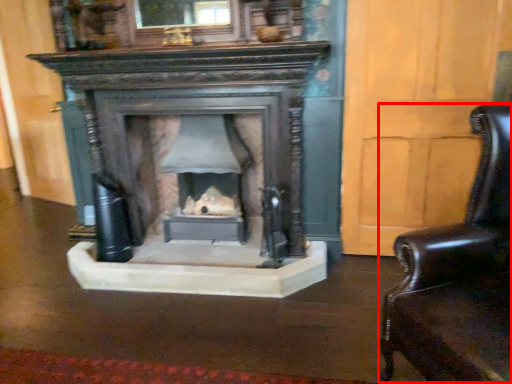
Question: From the image's perspective, what is the correct spatial positioning of swivel chair (annotated by the red box) in reference to fireplace?

Choices:
 (A) below
 (B) above

Answer: (A)